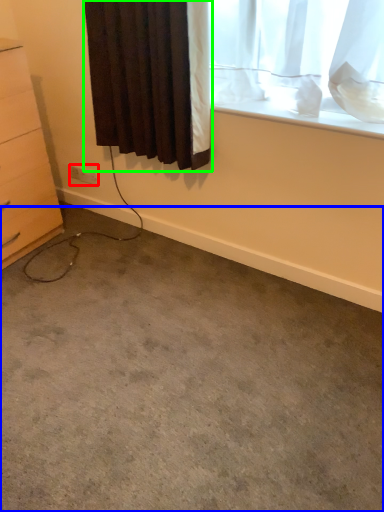
Question: Which object is positioned closest to electric outlet (highlighted by a red box)? Select from concrete (highlighted by a blue box) and curtain (highlighted by a green box).

Choices:
 (A) concrete
 (B) curtain

Answer: (B)